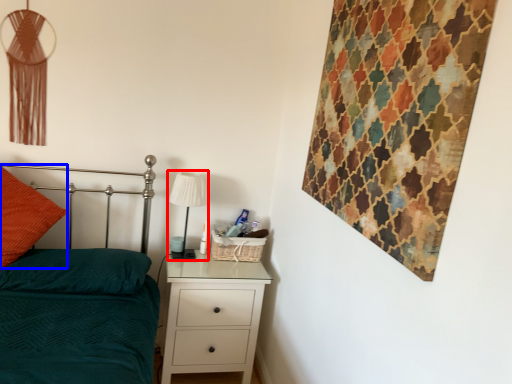
Question: Which point is closer to the camera, table lamp (highlighted by a red box) or throw pillow (highlighted by a blue box)?

Choices:
 (A) table lamp
 (B) throw pillow

Answer: (B)